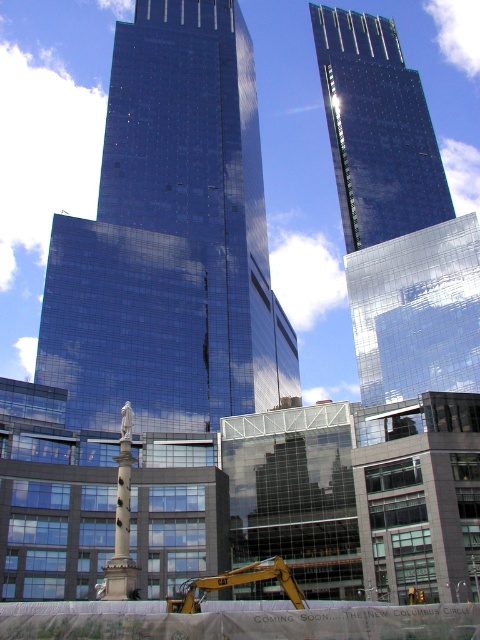
You are a city planner reviewing this urban design. You need to ensure that the yellow metallic excavator at lower center can safely move around the glossy glass skyscraper at upper center without damaging its reflective facade. Based on their positions, which direction should the excavator avoid moving to prevent collision?

The glossy glass skyscraper at upper center is to the right of the yellow metallic excavator at lower center. Therefore, the excavator should avoid moving to the right to prevent collision with the skyscraper.

You are standing at the base of the skyscrapers and want to take a photo of the point at coordinates point (228, 230). If your camera has a maximum focus range of 100 meters, will you be able to focus on that point?

The distance of point (228, 230) from the camera is 110.91 meters, which exceeds the camera maximum focus range of 100 meters. Therefore, the camera cannot focus on that point.

Based on the provided scene description, what does the point at coordinates (x=169, y=237) represent?

The point at coordinates (x=169, y=237) marks the location of the glossy glass skyscraper at center.